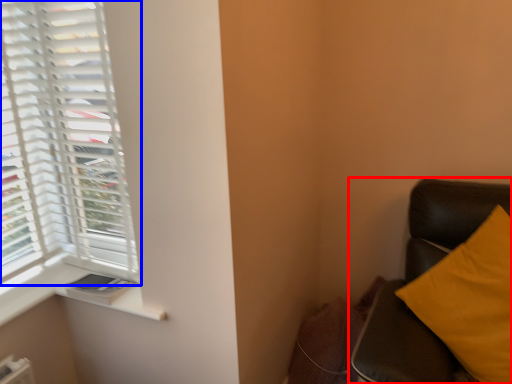
Question: Which object appears closest to the camera in this image, furniture (highlighted by a red box) or window (highlighted by a blue box)?

Choices:
 (A) furniture
 (B) window

Answer: (A)